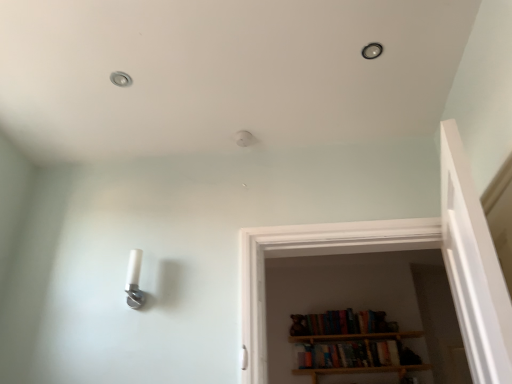
Question: Is the position of wooden bookshelf at center less distant than that of matte black light fixture at upper center?

Choices:
 (A) yes
 (B) no

Answer: (B)

Question: Is wooden bookshelf at center located outside matte black light fixture at upper center?

Choices:
 (A) no
 (B) yes

Answer: (B)

Question: Is wooden bookshelf at center to the right of matte black light fixture at upper center from the viewer's perspective?

Choices:
 (A) no
 (B) yes

Answer: (B)

Question: From the image's perspective, does wooden bookshelf at center appear lower than matte black light fixture at upper center?

Choices:
 (A) yes
 (B) no

Answer: (A)

Question: Is wooden bookshelf at center far from matte black light fixture at upper center?

Choices:
 (A) no
 (B) yes

Answer: (B)

Question: Is wooden bookshelf at center aimed at matte black light fixture at upper center?

Choices:
 (A) no
 (B) yes

Answer: (A)

Question: Is the depth of metallic ceiling light at upper left greater than that of matte black light fixture at upper center?

Choices:
 (A) yes
 (B) no

Answer: (A)

Question: Does metallic ceiling light at upper left appear on the left side of matte black light fixture at upper center?

Choices:
 (A) yes
 (B) no

Answer: (A)

Question: Is metallic ceiling light at upper left in front of matte black light fixture at upper center?

Choices:
 (A) yes
 (B) no

Answer: (B)

Question: Can you confirm if metallic ceiling light at upper left is smaller than matte black light fixture at upper center?

Choices:
 (A) yes
 (B) no

Answer: (A)

Question: Can you confirm if metallic ceiling light at upper left is wider than matte black light fixture at upper center?

Choices:
 (A) yes
 (B) no

Answer: (A)

Question: Is metallic ceiling light at upper left far away from matte black light fixture at upper center?

Choices:
 (A) no
 (B) yes

Answer: (A)

Question: From a real-world perspective, is metallic ceiling light at upper left located higher than wooden bookshelf at center?

Choices:
 (A) yes
 (B) no

Answer: (A)